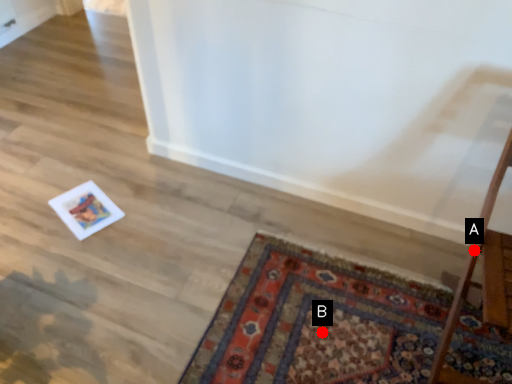
Question: Two points are circled on the image, labeled by A and B beside each circle. Which of the following is the closest to the observer?

Choices:
 (A) A is closer
 (B) B is closer

Answer: (A)